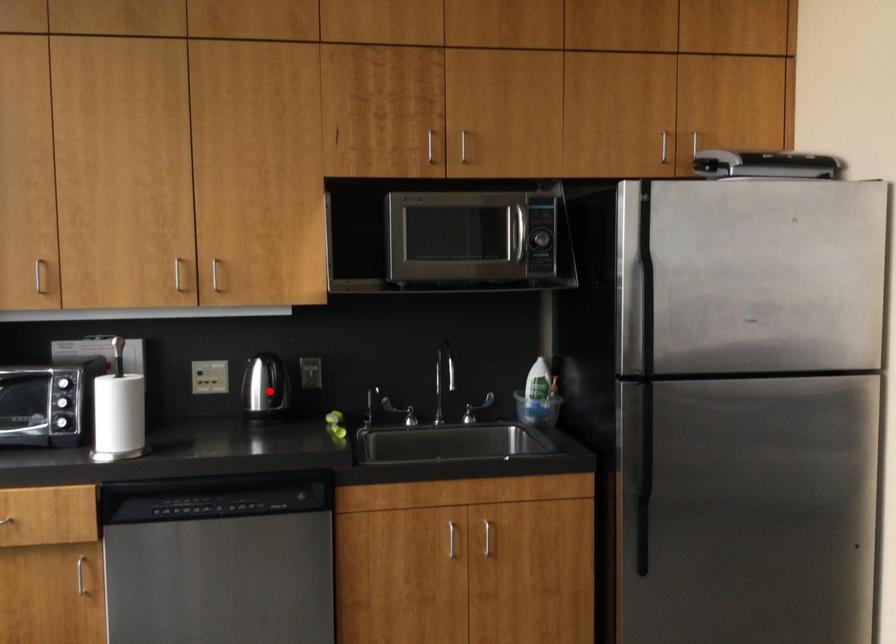
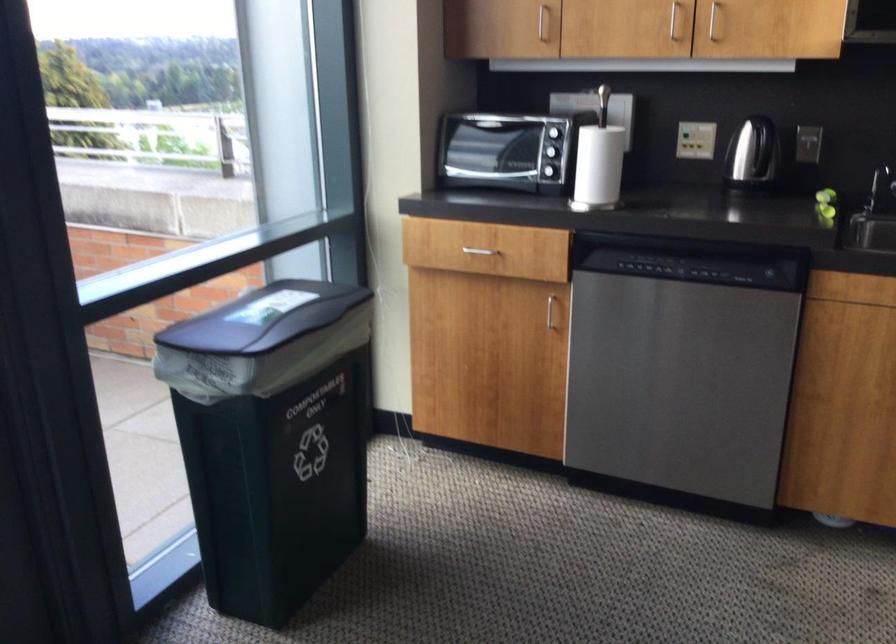
Find the pixel in the second image that matches the highlighted location in the first image.

(752, 152)